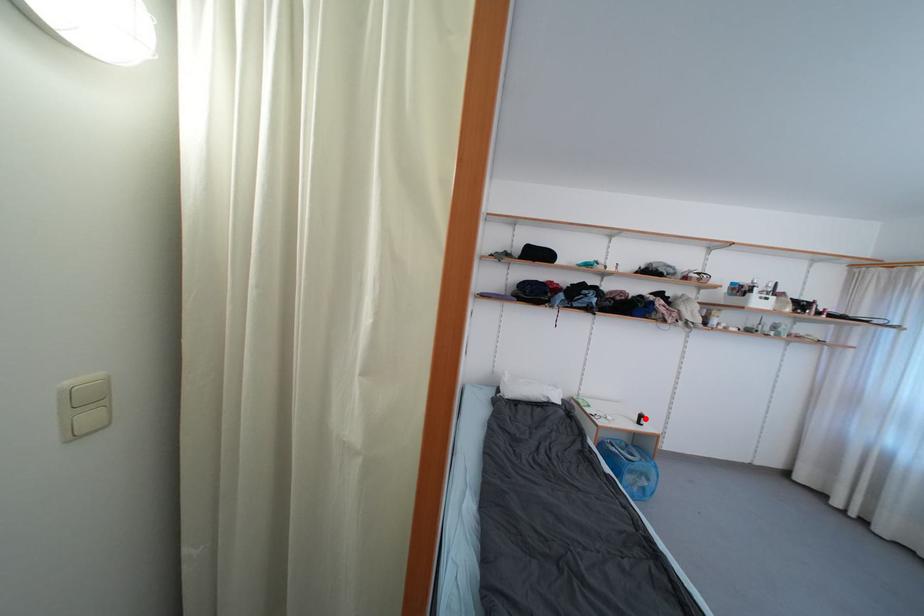
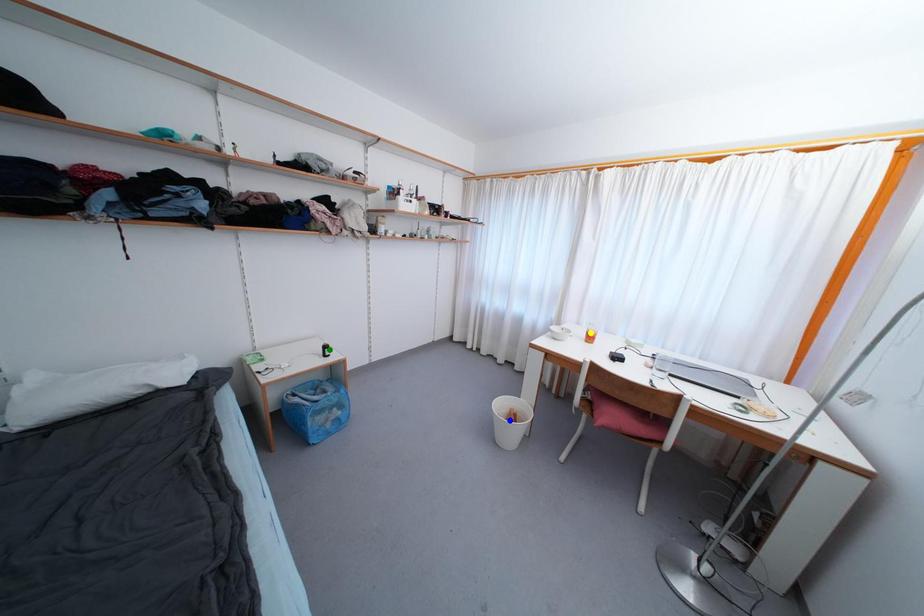
Question: I am providing you with two images of the same scene from different viewpoints. A red point is marked on the first image. You are given multiple points on the second image. Which mark in image 2 goes with the point in image 1?

Choices:
 (A) yellow point
 (B) green point
 (C) blue point

Answer: (B)